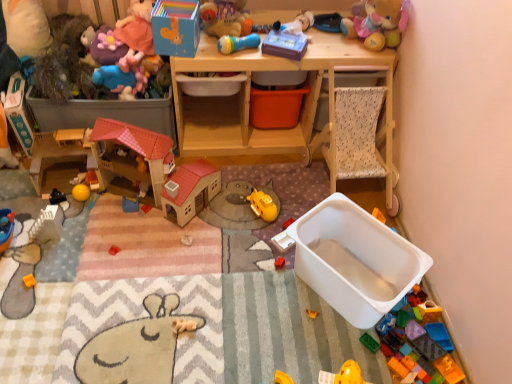
You are a GUI agent. You are given a task and a screenshot of the screen. Output one action in this format:
    pyautogui.click(x=<x>, y=<y>)
    Task: Click on the free location in front of blue plastic toy at center, the 5th toy viewed from the left
    
    Given the screenshot: What is the action you would take?
    pyautogui.click(x=121, y=238)